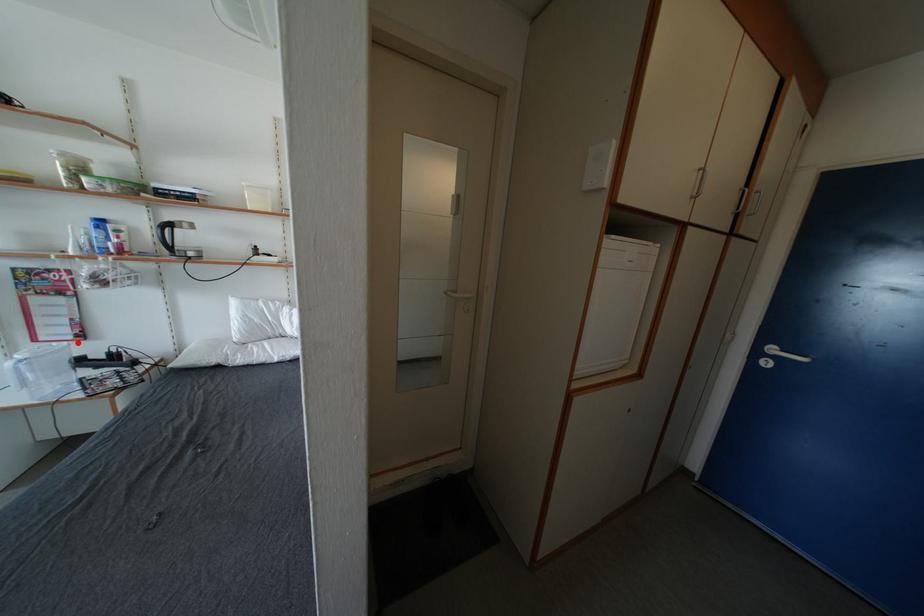
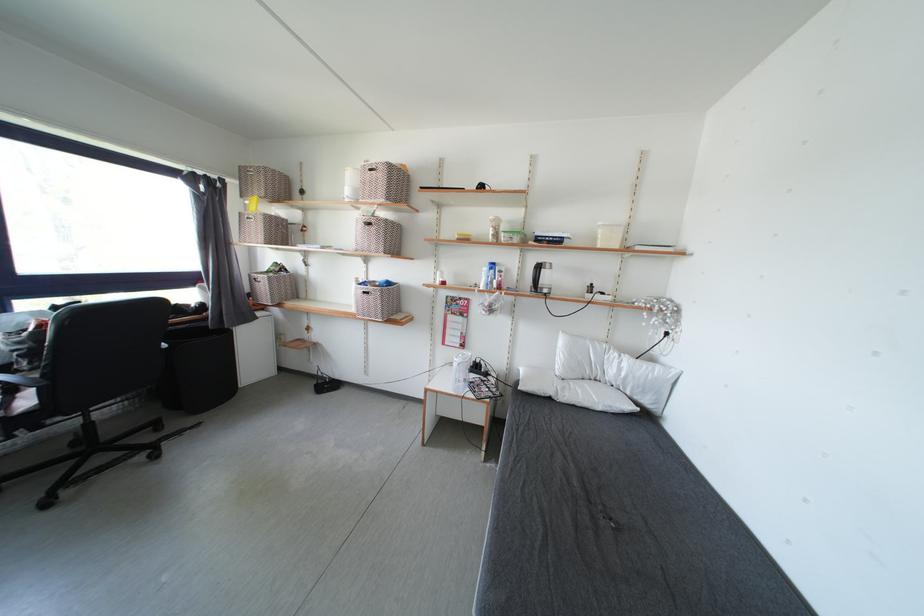
Question: I am providing you with two images of the same scene from different viewpoints. Given a red point in image1, look at the same physical point in image2. Is it:

Choices:
 (A) Closer to the viewpoint
 (B) Farther from the viewpoint

Answer: (B)